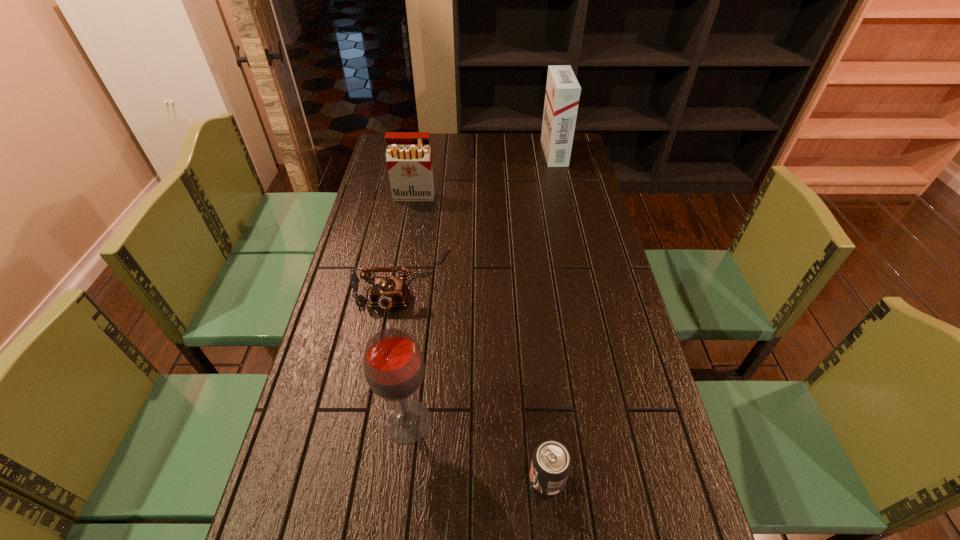
At what (x,y) coordinates should I click in order to perform the action: click on free spot at the left edge of the desktop. Please return your answer as a coordinate pair (x, y). Looking at the image, I should click on (348, 319).

This screenshot has width=960, height=540. In the image, there is a desktop. Identify the location of vacant area at the right edge. (620, 305).

Where is `vacant area between the nearer cigarette case and the nearest object`? The image size is (960, 540). vacant area between the nearer cigarette case and the nearest object is located at coordinates (481, 336).

The width and height of the screenshot is (960, 540). I want to click on vacant space in between the fourth farthest object and the soda can, so click(477, 449).

Find the location of `free space between the taller cigarette case and the second nearest object`. free space between the taller cigarette case and the second nearest object is located at coordinates (481, 287).

Locate an element on the screen. The width and height of the screenshot is (960, 540). free area in between the right cigarette case and the telephone is located at coordinates (478, 217).

The image size is (960, 540). Identify the location of vacant area that lies between the shortest object and the third tallest object. (481, 336).

Identify the location of free space that is in between the rightmost object and the shortest object. (551, 315).

You are a GUI agent. You are given a task and a screenshot of the screen. Output one action in this format:
    pyautogui.click(x=<x>, y=<y>)
    Task: Click on the unoccupied area between the fourth farthest object and the farthest object
    This screenshot has height=540, width=960.
    Given the screenshot: What is the action you would take?
    pyautogui.click(x=481, y=287)

At what (x,y) coordinates should I click in order to perform the action: click on free space that is in between the shortest object and the second nearest object. Please return your answer as a coordinate pair (x, y). The height and width of the screenshot is (540, 960). Looking at the image, I should click on (477, 449).